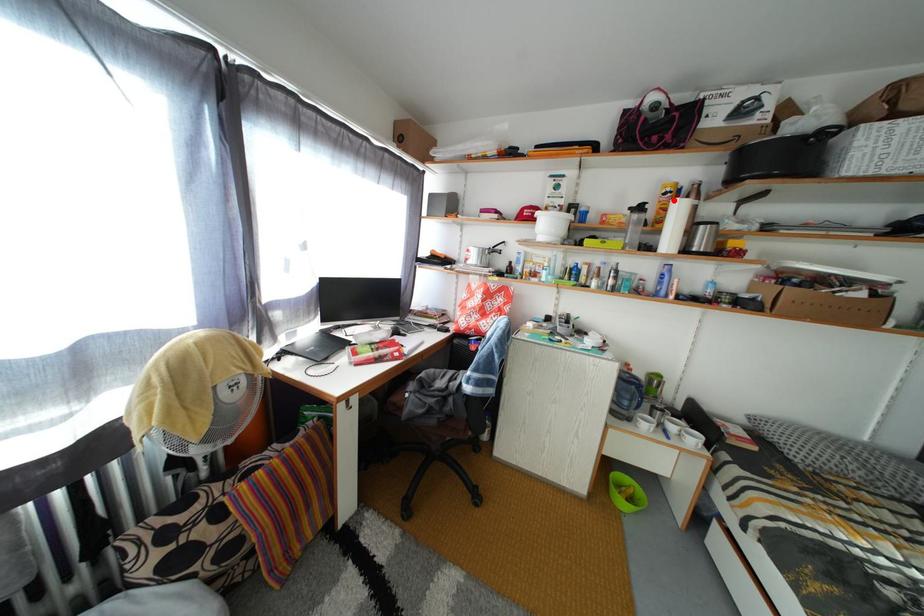
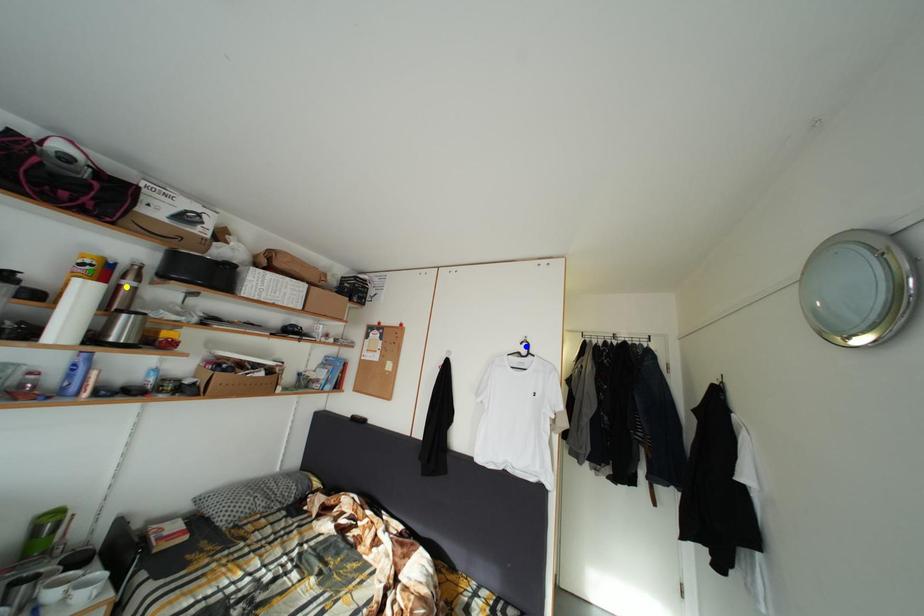
Question: I am providing you with two images of the same scene from different viewpoints. A red point is marked on the first image. You are given multiple points on the second image. Which spot in image 2 lines up with the point in image 1?

Choices:
 (A) yellow point
 (B) blue point
 (C) green point

Answer: (C)